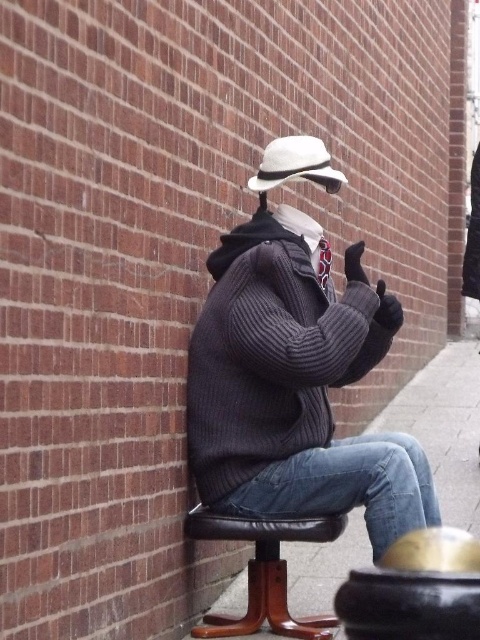
You are a delivery drone flying towards the mannequin in the scene. You need to pass between two points marked as point (342, 547) and point (253, 529). Which point should you fly over first to ensure you are moving towards the mannequin?

You should fly over point (253, 529) first because point (342, 547) is behind it, meaning point (253, 529) is closer to the mannequin and in your path towards it.

You are a photographer standing at a certain position. You want to capture a closeup shot of the knitted sweater at center. Considering the distance, is it advisable to use a telephoto lens?

The knitted sweater at center is 3.03 meters away from the camera. A telephoto lens is suitable for capturing distant subjects, so using one would allow you to get a closeup without moving closer.

You are a delivery robot with a 2.5 meter long package that needs to be placed between the knitted sweater at center and the jeans at lower right. Can the package fit in the space between them?

The distance between the knitted sweater at center and the jeans at lower right is 3.04 meters, so the 2.5 meter long package can fit in the space between them since it is shorter than the available distance.